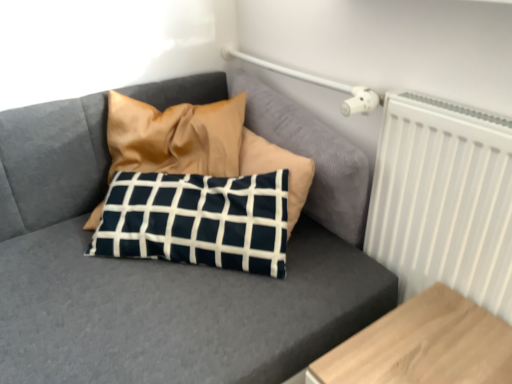
Question: From the image's perspective, is white matte radiator at upper right under light brown wood table at lower right?

Choices:
 (A) no
 (B) yes

Answer: (A)

Question: Is white matte radiator at upper right smaller than light brown wood table at lower right?

Choices:
 (A) yes
 (B) no

Answer: (A)

Question: Considering the relative sizes of white matte radiator at upper right and light brown wood table at lower right in the image provided, is white matte radiator at upper right bigger than light brown wood table at lower right?

Choices:
 (A) no
 (B) yes

Answer: (A)

Question: Considering the relative sizes of white matte radiator at upper right and light brown wood table at lower right in the image provided, is white matte radiator at upper right thinner than light brown wood table at lower right?

Choices:
 (A) no
 (B) yes

Answer: (B)

Question: Considering the relative sizes of white matte radiator at upper right and light brown wood table at lower right in the image provided, is white matte radiator at upper right taller than light brown wood table at lower right?

Choices:
 (A) no
 (B) yes

Answer: (B)

Question: Is white matte radiator at upper right far away from light brown wood table at lower right?

Choices:
 (A) no
 (B) yes

Answer: (A)

Question: Is white matte radiator at upper right outside navy blue fabric pillow at center?

Choices:
 (A) yes
 (B) no

Answer: (A)

Question: From a real-world perspective, is white matte radiator at upper right over navy blue fabric pillow at center?

Choices:
 (A) no
 (B) yes

Answer: (B)

Question: Considering the relative sizes of white matte radiator at upper right and navy blue fabric pillow at center in the image provided, is white matte radiator at upper right wider than navy blue fabric pillow at center?

Choices:
 (A) yes
 (B) no

Answer: (B)

Question: Does white matte radiator at upper right have a lesser width compared to navy blue fabric pillow at center?

Choices:
 (A) yes
 (B) no

Answer: (A)

Question: Does white matte radiator at upper right appear on the left side of navy blue fabric pillow at center?

Choices:
 (A) no
 (B) yes

Answer: (A)

Question: Is there a large distance between white matte radiator at upper right and navy blue fabric pillow at center?

Choices:
 (A) yes
 (B) no

Answer: (B)

Question: Considering the relative sizes of navy blue fabric pillow at center and white matte radiator at upper right in the image provided, is navy blue fabric pillow at center smaller than white matte radiator at upper right?

Choices:
 (A) no
 (B) yes

Answer: (A)